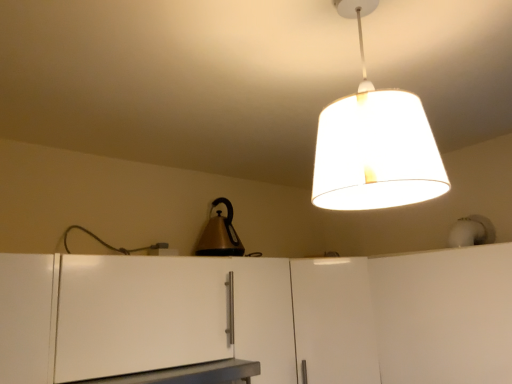
Question: In terms of size, does white matte cabinet at center, the 2th cabinetry positioned from the right, appear bigger or smaller than white matte cabinet at lower left, arranged as the first cabinetry when viewed from the left?

Choices:
 (A) small
 (B) big

Answer: (B)

Question: From a real-world perspective, relative to white matte cabinet at lower left, arranged as the first cabinetry when viewed from the left, is white matte cabinet at center, placed as the second cabinetry when sorted from left to right, vertically above or below?

Choices:
 (A) above
 (B) below

Answer: (B)

Question: Which of these objects is positioned closest to the white matte cabinet at lower right, the third cabinetry viewed from the left?

Choices:
 (A) white matte cabinet at lower left, the third cabinetry viewed from the right
 (B) metallic gold kettle at center
 (C) white fabric lampshade at upper center
 (D) white matte cabinet at center, the 2th cabinetry positioned from the right
 (E) metallic gray table at lower center

Answer: (D)

Question: Estimate the real-world distances between objects in this image. Which object is farther from the white matte cabinet at lower left, arranged as the first cabinetry when viewed from the left?

Choices:
 (A) metallic gold kettle at center
 (B) metallic gray table at lower center
 (C) white fabric lampshade at upper center
 (D) white matte cabinet at center, the 2th cabinetry positioned from the right
 (E) white matte cabinet at lower right, acting as the 1th cabinetry starting from the right

Answer: (C)